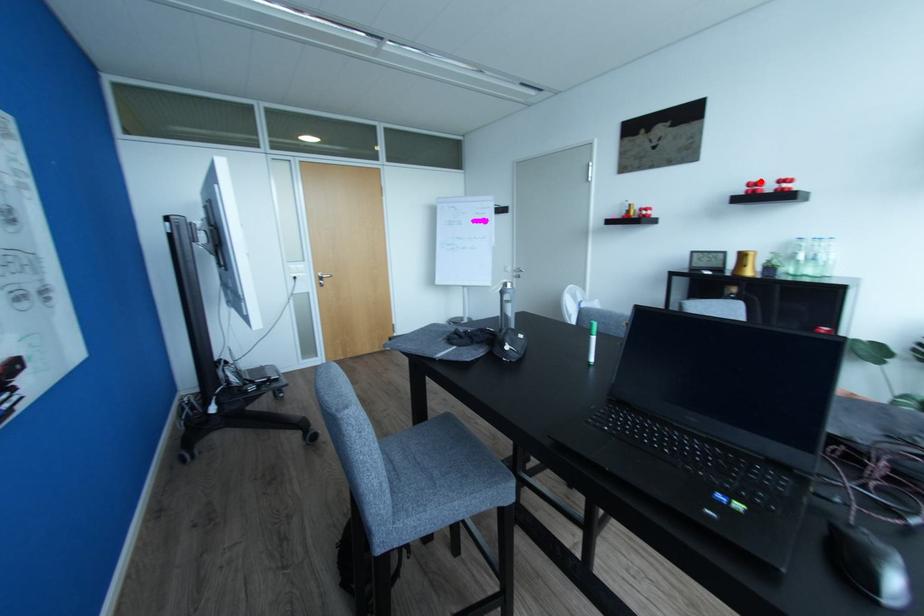
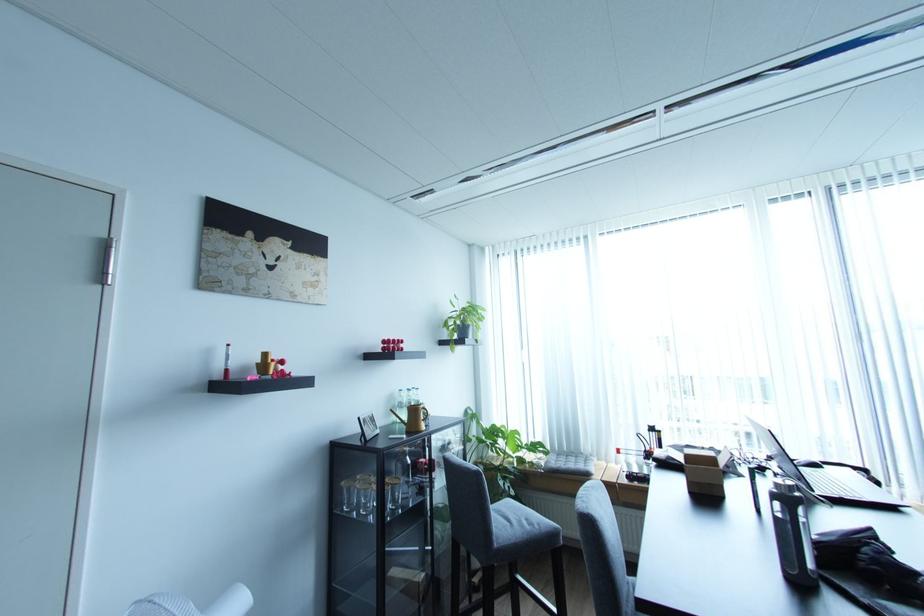
Locate, in the second image, the point that corresponds to the highlighted location in the first image.

(395, 339)